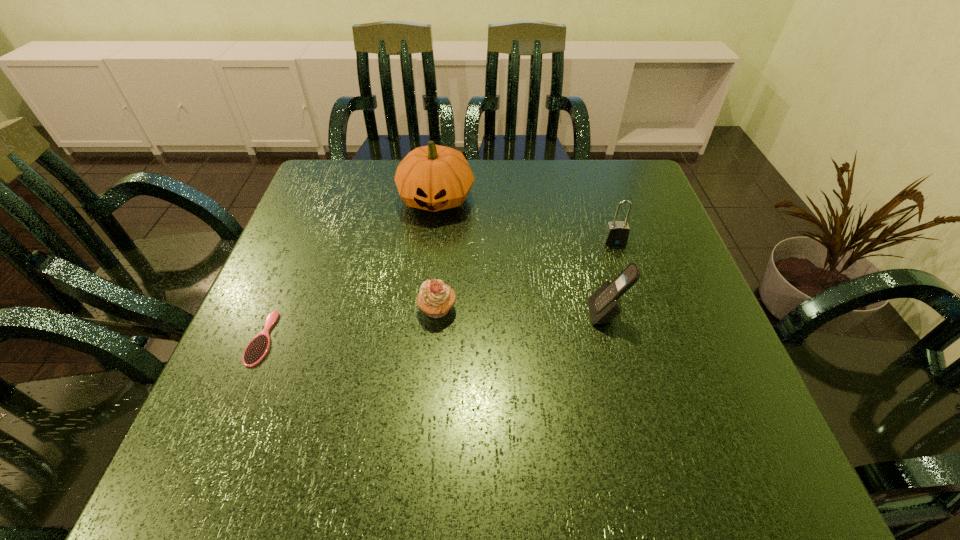
Where is `the farthest object`? the farthest object is located at coordinates (434, 178).

Where is `gourd`? gourd is located at coordinates (434, 178).

You are a GUI agent. You are given a task and a screenshot of the screen. Output one action in this format:
    pyautogui.click(x=<x>, y=<y>)
    Task: Click on the second object from right to left
    
    Given the screenshot: What is the action you would take?
    pyautogui.click(x=604, y=305)

Find the location of a particular element. padlock is located at coordinates (617, 232).

This screenshot has height=540, width=960. I want to click on the rightmost object, so click(x=617, y=232).

Where is `cupcake`? cupcake is located at coordinates (435, 298).

Identify the location of the shortest object. (257, 349).

The height and width of the screenshot is (540, 960). What are the coordinates of `the leftmost object` in the screenshot? It's located at (257, 349).

At what (x,y) coordinates should I click in order to perform the action: click on free space located on the side of the tallest object with the carved face. Please return your answer as a coordinate pair (x, y). This screenshot has width=960, height=540. Looking at the image, I should click on (431, 242).

Where is `vacant point located 0.360m on the front-facing side of the fourth object from left to right`? This screenshot has width=960, height=540. vacant point located 0.360m on the front-facing side of the fourth object from left to right is located at coordinates (409, 314).